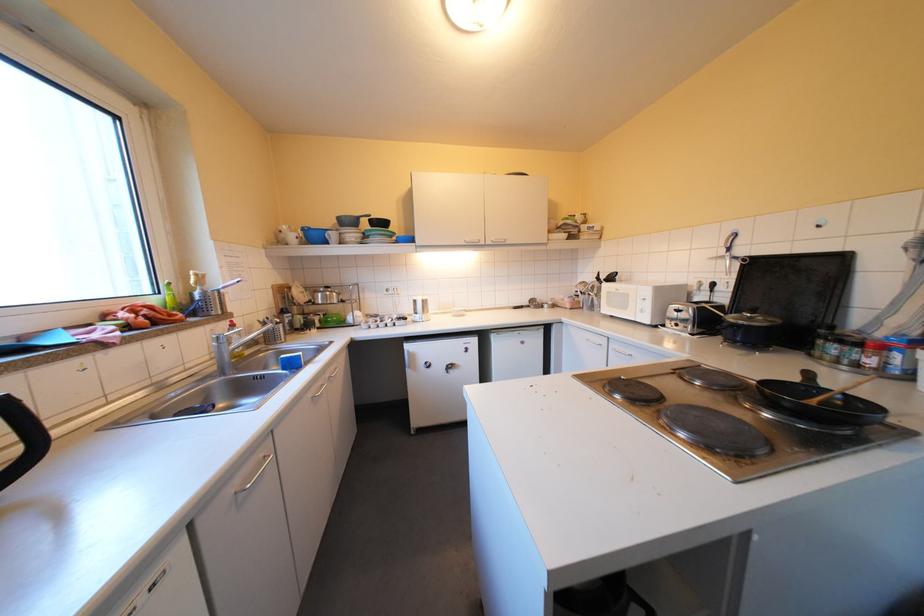
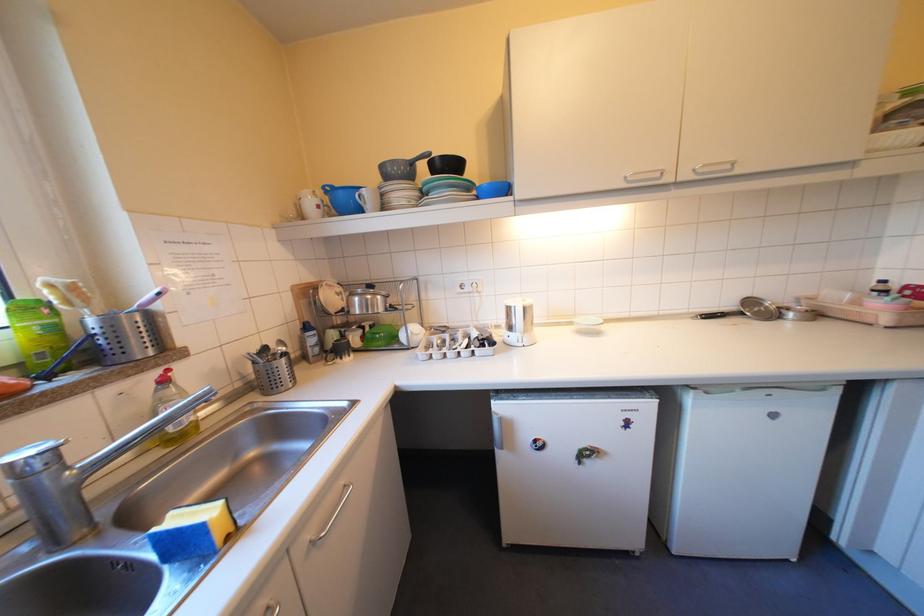
In the second image, find the point that corresponds to the point at 312,317 in the first image.

(346, 334)